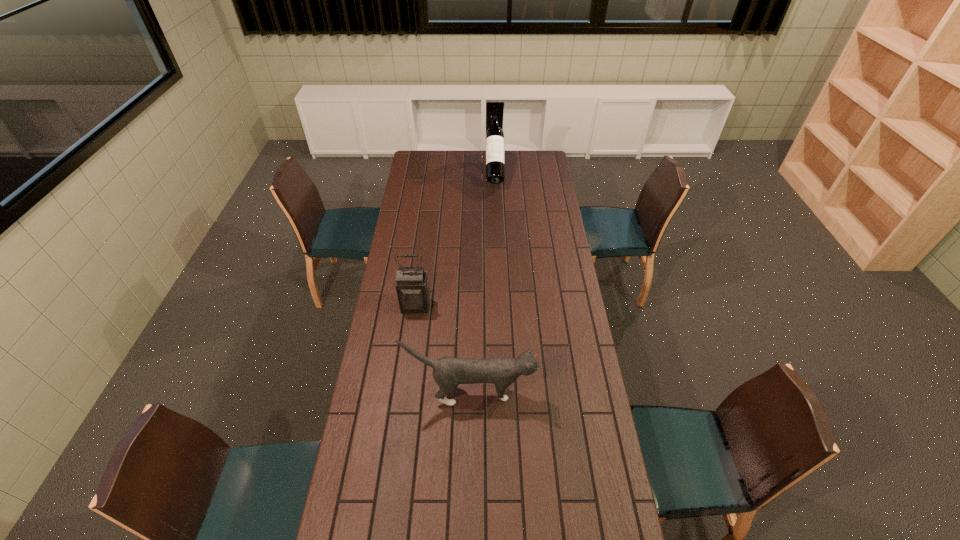
You are a GUI agent. You are given a task and a screenshot of the screen. Output one action in this format:
    pyautogui.click(x=<x>, y=<y>)
    Task: Click on the free spot at the far edge of the desktop
    This screenshot has height=540, width=960.
    Given the screenshot: What is the action you would take?
    pyautogui.click(x=447, y=154)

Find the location of `free space at the left edge`. free space at the left edge is located at coordinates (378, 379).

Find the location of a particular element. The height and width of the screenshot is (540, 960). free space at the right edge of the desktop is located at coordinates (544, 222).

Find the location of a particular element. This screenshot has width=960, height=540. vacant space at the far left corner is located at coordinates (439, 154).

Find the location of a particular element. This screenshot has width=960, height=540. vacant area between the nearest object and the wine bottle is located at coordinates (483, 282).

The width and height of the screenshot is (960, 540). Find the location of `empty space between the lantern and the tallest object`. empty space between the lantern and the tallest object is located at coordinates (455, 239).

This screenshot has height=540, width=960. Find the location of `blank region between the cat and the wine bottle`. blank region between the cat and the wine bottle is located at coordinates (483, 282).

The width and height of the screenshot is (960, 540). I want to click on free space between the tallest object and the second farthest object, so click(455, 239).

Locate which object is the second closest to the second nearest object. Please provide its 2D coordinates. Your answer should be formatted as a tuple, i.e. [(x, y)], where the tuple contains the x and y coordinates of a point satisfying the conditions above.

[(495, 159)]

Locate an element on the screen. object that is the second closest one to the second farthest object is located at coordinates (495, 159).